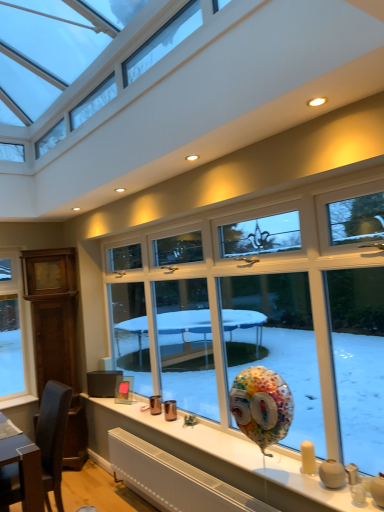
This screenshot has width=384, height=512. What do you see at coordinates (308, 457) in the screenshot?
I see `yellow matte candle at lower right` at bounding box center [308, 457].

In order to face yellow matte candle at lower right, should I rotate leftwards or rightwards?

To face it directly, rotate right by 15.216 degrees.

At what (x,y) coordinates should I click in order to perform the action: click on yellow matte candle at lower right. Please return your answer as a coordinate pair (x, y). Looking at the image, I should click on (308, 457).

Measure the distance between matte white vase at lower right and camera.

matte white vase at lower right and camera are 2.01 meters apart from each other.

Identify the location of matte white vase at lower right. This screenshot has height=512, width=384. (332, 474).

What do you see at coordinates (332, 474) in the screenshot? The height and width of the screenshot is (512, 384). I see `matte white vase at lower right` at bounding box center [332, 474].

At what (x,y) coordinates should I click in order to perform the action: click on yellow matte candle at lower right. Please return your answer as a coordinate pair (x, y). The width and height of the screenshot is (384, 512). Looking at the image, I should click on (308, 457).

Which object is positioned more to the left, yellow matte candle at lower right or matte white vase at lower right?

yellow matte candle at lower right is more to the left.

Between yellow matte candle at lower right and matte white vase at lower right, which one is positioned behind?

yellow matte candle at lower right.

Which is closer to the camera, (309,459) or (334,467)?

Clearly, point (309,459) is more distant from the camera than point (334,467).

From the image's perspective, who appears lower, yellow matte candle at lower right or matte white vase at lower right?

matte white vase at lower right, from the image's perspective.

From a real-world perspective, is yellow matte candle at lower right positioned above or below matte white vase at lower right?

In terms of real-world spatial position, yellow matte candle at lower right is above matte white vase at lower right.

From the picture: Which of these two, yellow matte candle at lower right or matte white vase at lower right, is wider?

matte white vase at lower right is wider.

Does yellow matte candle at lower right have a lesser height compared to matte white vase at lower right?

Incorrect, the height of yellow matte candle at lower right does not fall short of that of matte white vase at lower right.

Considering the relative sizes of yellow matte candle at lower right and matte white vase at lower right in the image provided, is yellow matte candle at lower right smaller than matte white vase at lower right?

Indeed, yellow matte candle at lower right has a smaller size compared to matte white vase at lower right.

Consider the image. Is yellow matte candle at lower right located outside matte white vase at lower right?

Absolutely, yellow matte candle at lower right is external to matte white vase at lower right.

Does yellow matte candle at lower right touch matte white vase at lower right?

Yes, yellow matte candle at lower right is right next to matte white vase at lower right and making contact.

Is yellow matte candle at lower right facing away from matte white vase at lower right?

No, matte white vase at lower right is not at the back of yellow matte candle at lower right.

I want to click on candle holder below the yellow matte candle at lower right (from a real-world perspective), so click(x=332, y=474).

Can you confirm if matte white vase at lower right is positioned to the right of yellow matte candle at lower right?

Correct, you'll find matte white vase at lower right to the right of yellow matte candle at lower right.

Is matte white vase at lower right positioned behind yellow matte candle at lower right?

No.

Which is less distant, (337, 487) or (313, 463)?

Point (337, 487) appears to be closer to the viewer than point (313, 463).

From the image's perspective, relative to yellow matte candle at lower right, is matte white vase at lower right above or below?

Clearly, from the image's perspective, matte white vase at lower right is below yellow matte candle at lower right.

From a real-world perspective, is matte white vase at lower right positioned under yellow matte candle at lower right based on gravity?

Yes, from a real-world perspective, matte white vase at lower right is under yellow matte candle at lower right.

Looking at this image, considering the relative sizes of matte white vase at lower right and yellow matte candle at lower right in the image provided, is matte white vase at lower right wider than yellow matte candle at lower right?

Correct, the width of matte white vase at lower right exceeds that of yellow matte candle at lower right.

Considering the sizes of objects matte white vase at lower right and yellow matte candle at lower right in the image provided, who is taller, matte white vase at lower right or yellow matte candle at lower right?

With more height is yellow matte candle at lower right.

Between matte white vase at lower right and yellow matte candle at lower right, which one has larger size?

With larger size is matte white vase at lower right.

Would you say matte white vase at lower right contains yellow matte candle at lower right?

Actually, yellow matte candle at lower right is outside matte white vase at lower right.

Are matte white vase at lower right and yellow matte candle at lower right located far from each other?

That's not correct — matte white vase at lower right is a little close to yellow matte candle at lower right.

Is matte white vase at lower right oriented towards yellow matte candle at lower right?

No, matte white vase at lower right is not turned towards yellow matte candle at lower right.

Can you tell me how much matte white vase at lower right and yellow matte candle at lower right differ in facing direction?

There is a 0.000206-degree angle between the facing directions of matte white vase at lower right and yellow matte candle at lower right.

Find the location of a particular element. Image resolution: width=384 pixels, height=512 pixels. candle holder in front of the yellow matte candle at lower right is located at coordinates (332, 474).

At what (x,y) coordinates should I click in order to perform the action: click on candle located above the matte white vase at lower right (from a real-world perspective). Please return your answer as a coordinate pair (x, y). This screenshot has width=384, height=512. Looking at the image, I should click on point(308,457).

This screenshot has height=512, width=384. Find the location of `candle above the matte white vase at lower right (from the image's perspective)`. candle above the matte white vase at lower right (from the image's perspective) is located at coordinates (308, 457).